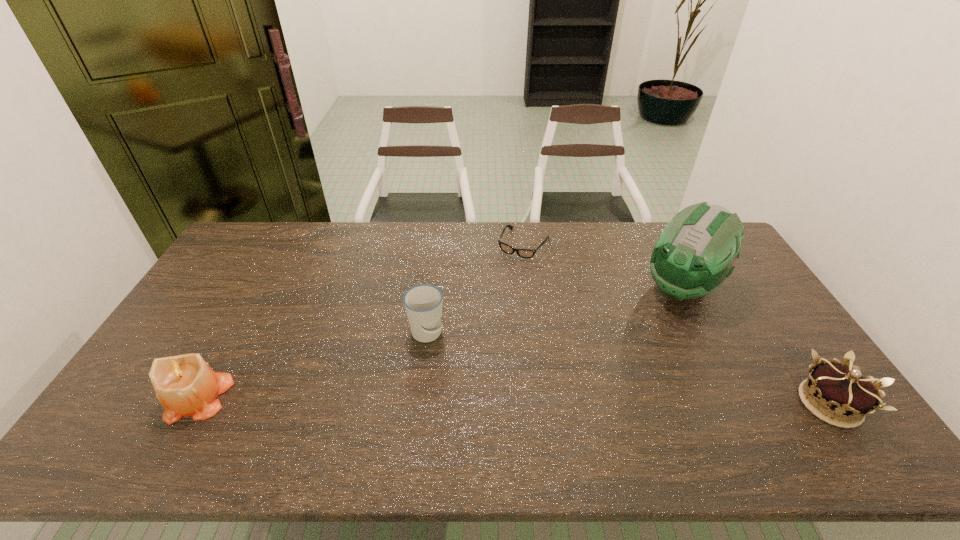
At what (x,y) coordinates should I click in order to perform the action: click on vacant region located 0.060m with a handle on the side of the third farthest object. Please return your answer as a coordinate pair (x, y). Looking at the image, I should click on (442, 363).

Where is `vacant space located 0.090m with a handle on the side of the third farthest object`? vacant space located 0.090m with a handle on the side of the third farthest object is located at coordinates (445, 372).

Find the location of a particular element. free region located 0.050m on the front-facing side of the spectacles is located at coordinates (510, 268).

Identify the location of vacant space located on the front-facing side of the spectacles. Image resolution: width=960 pixels, height=540 pixels. (494, 296).

Identify the location of free region located 0.150m on the front-facing side of the spectacles. (499, 286).

At what (x,y) coordinates should I click in order to perform the action: click on vacant space located 0.220m on the visor of the tallest object. Please return your answer as a coordinate pair (x, y). The height and width of the screenshot is (540, 960). Looking at the image, I should click on (625, 348).

Where is `vacant region located on the visor of the tallest object`? vacant region located on the visor of the tallest object is located at coordinates (653, 319).

The image size is (960, 540). Identify the location of vacant space located 0.110m on the visor of the tallest object. (644, 327).

Identify the location of spectacles present at the far edge. (523, 253).

Locate an element on the screen. Image resolution: width=960 pixels, height=540 pixels. football helmet that is at the far edge is located at coordinates (695, 253).